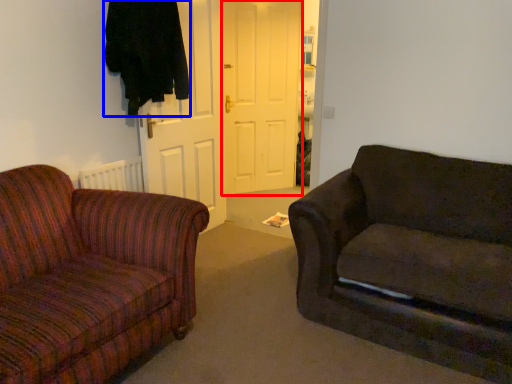
Question: Among these objects, which one is farthest to the camera, door (highlighted by a red box) or clothing (highlighted by a blue box)?

Choices:
 (A) door
 (B) clothing

Answer: (A)